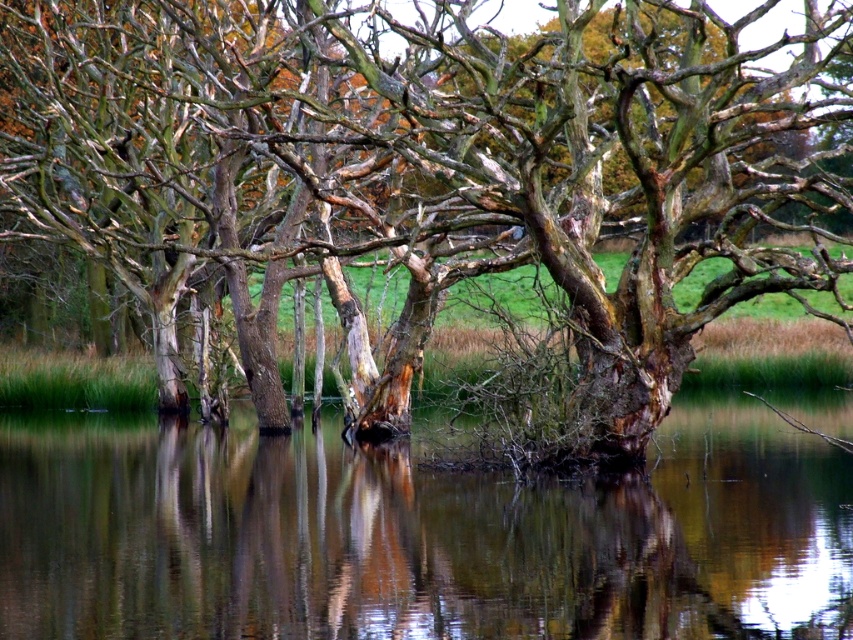
You are an artist trying to capture this scene. You want to paint the smooth bark tree at center and the transparent water at center. Which object should you paint first if you want to follow the natural left to right flow of the scene?

You should paint the smooth bark tree at center first because it is positioned on the left side of transparent water at center, following the left to right flow.

You are an environmental scientist assessing the health of trees in a wetland area. You observe a smooth bark tree at center and a brown wood at center. Which tree has a greater girth? Please base your answer on the visual evidence provided in the scene.

The smooth bark tree at center has a greater girth than the brown wood at center since its width surpasses the brown wood at center.

You are standing in front of the serene natural scene with the transparent water at center and the brown wood at center. Which object is closer to you?

The transparent water at center is closer to the viewer than the brown wood at center.